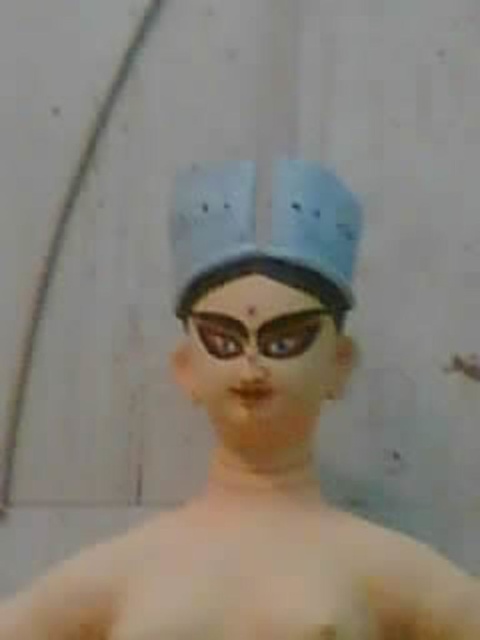
Does matte blue hat at center appear under matte black goggles at center?

Actually, matte blue hat at center is above matte black goggles at center.

Describe the element at coordinates (264, 228) in the screenshot. This screenshot has height=640, width=480. I see `matte blue hat at center` at that location.

At what (x,y) coordinates should I click in order to perform the action: click on matte blue hat at center. Please return your answer as a coordinate pair (x, y). Looking at the image, I should click on (264, 228).